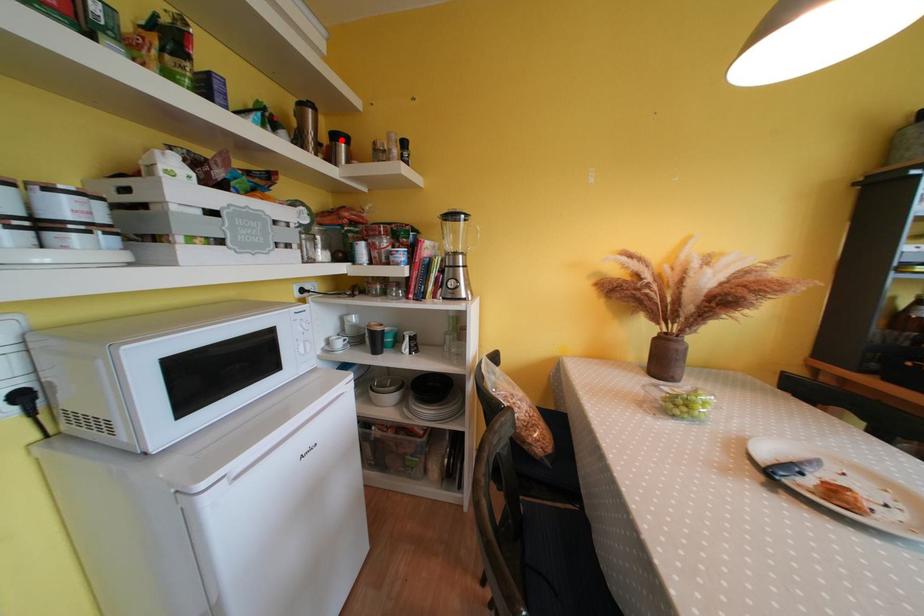
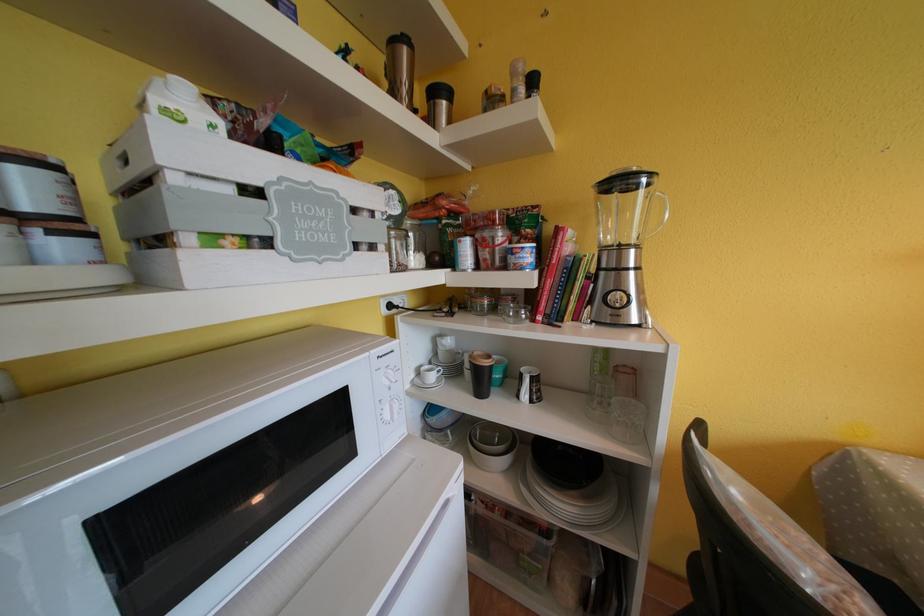
In the second image, find the point that corresponds to the highlighted location in the first image.

(440, 95)